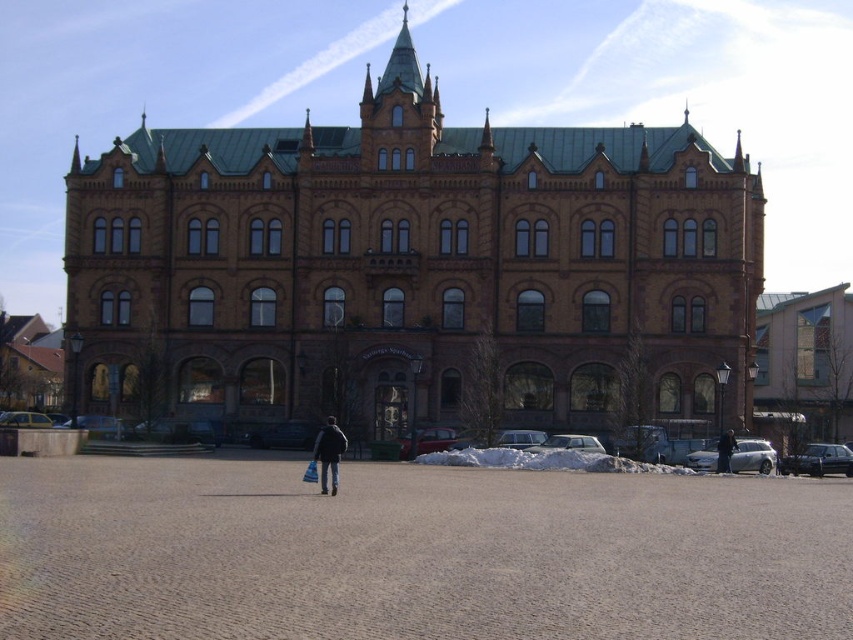
Is dark blue fabric at center to the left of black leather jacket at center from the viewer's perspective?

Yes, dark blue fabric at center is to the left of black leather jacket at center.

Is point (328, 492) more distant than point (722, 467)?

That is False.

The height and width of the screenshot is (640, 853). Describe the element at coordinates (329, 454) in the screenshot. I see `dark blue fabric at center` at that location.

Image resolution: width=853 pixels, height=640 pixels. I want to click on dark blue fabric at center, so click(329, 454).